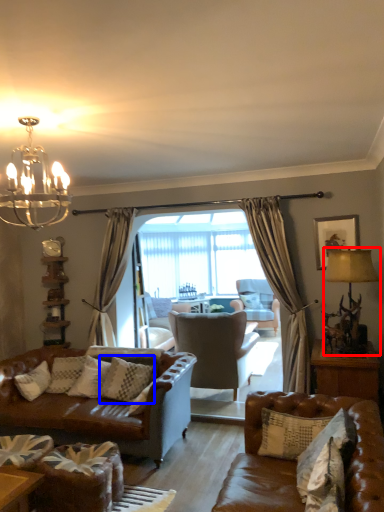
Question: Which object appears closest to the camera in this image, lamp (highlighted by a red box) or pillow (highlighted by a blue box)?

Choices:
 (A) lamp
 (B) pillow

Answer: (A)